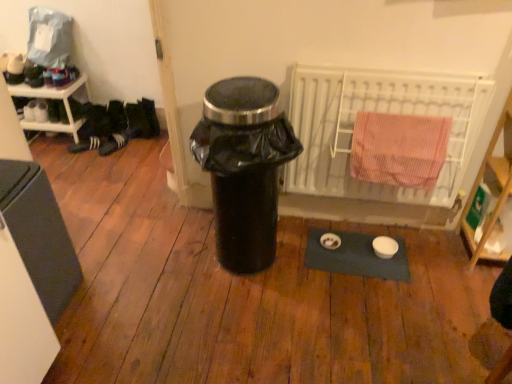
Question: Considering the relative positions of white textured shoe at left, which appears as the 2th shoe when viewed from the left, and matte gray refrigerator at left in the image provided, is white textured shoe at left, which appears as the 2th shoe when viewed from the left, to the left or to the right of matte gray refrigerator at left?

Choices:
 (A) left
 (B) right

Answer: (A)

Question: Which is correct: white textured shoe at left, which appears as the 2th shoe when viewed from the left, is inside matte gray refrigerator at left, or outside of it?

Choices:
 (A) inside
 (B) outside

Answer: (B)

Question: Considering the real-world distances, which object is farthest from the black matte shoe at left, which appears as the 1th shoe when viewed from the left?

Choices:
 (A) matte gray refrigerator at left
 (B) white textured shoe at left, which is the first shoe from right to left
 (C) wooden shelf at right, the 2th shelf viewed from the back
 (D) white metal radiator at upper right
 (E) white plastic shelf at left, which is the first shelf in top-to-bottom order

Answer: (C)

Question: Which object is the farthest from the white plastic shelf at left, which is the first shelf in top-to-bottom order?

Choices:
 (A) black plastic trash can at center
 (B) wooden shelf at right, which ranks as the 1th shelf in right-to-left order
 (C) white textured shoe at left, which appears as the 2th shoe when viewed from the left
 (D) white metal radiator at upper right
 (E) matte gray refrigerator at left

Answer: (B)